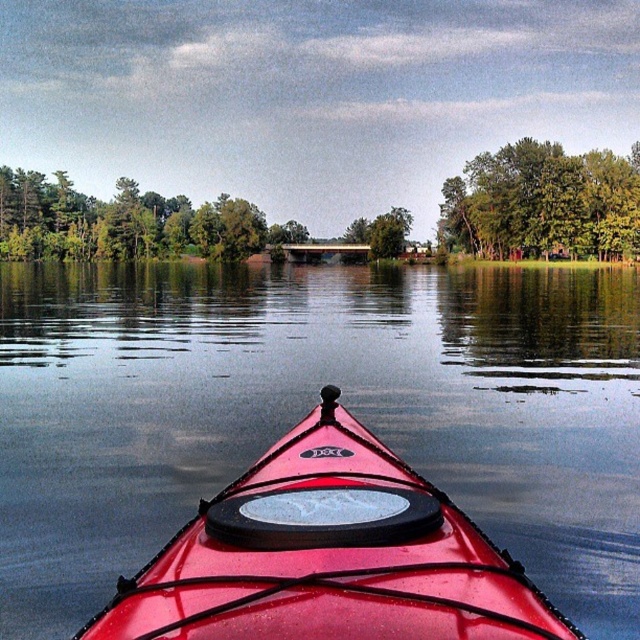
You are navigating a red kayak on a calm lake and need to position your kayak precisely. According to the coordinates provided, where is the shiny red kayak at center located?

The shiny red kayak at center is located at point (x=330, y=556).

You are in a red kayak looking out. You notice green leafy trees at upper center and a green matte tree at center. Which tree is closer to you?

The green leafy trees at upper center are closer to you because the green matte tree at center is behind them.

You are in a red kayak and see the green leafy tree at upper center and the green leafy trees at upper center. Which one is closer to you?

The green leafy tree at upper center is positioned under green leafy trees at upper center, so the green leafy tree at upper center is closer to you.